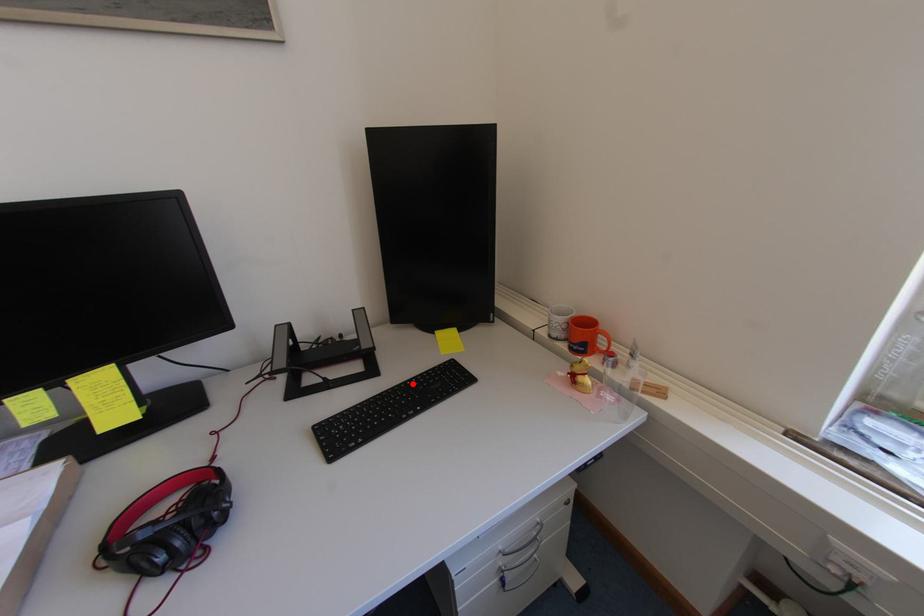
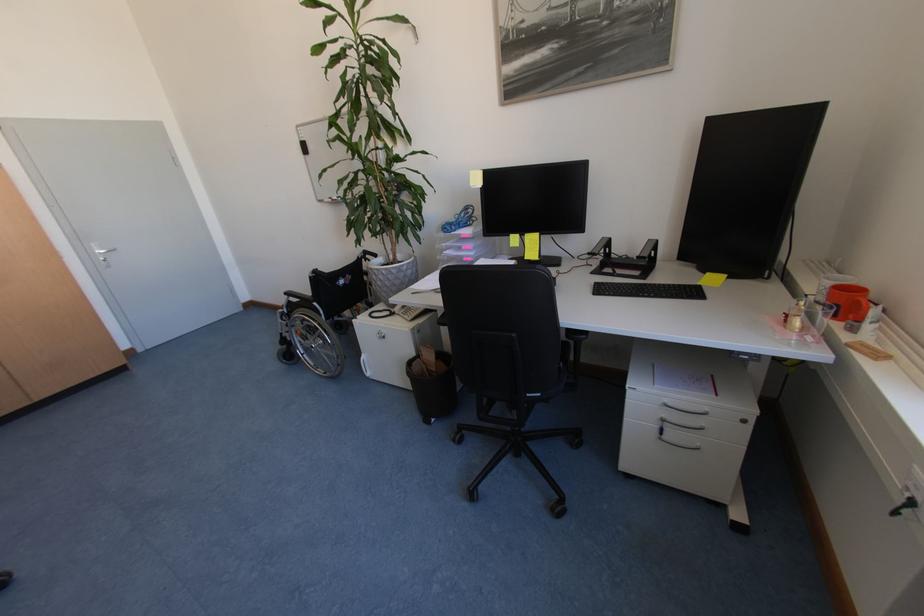
Find the pixel in the second image that matches the highlighted location in the first image.

(663, 285)